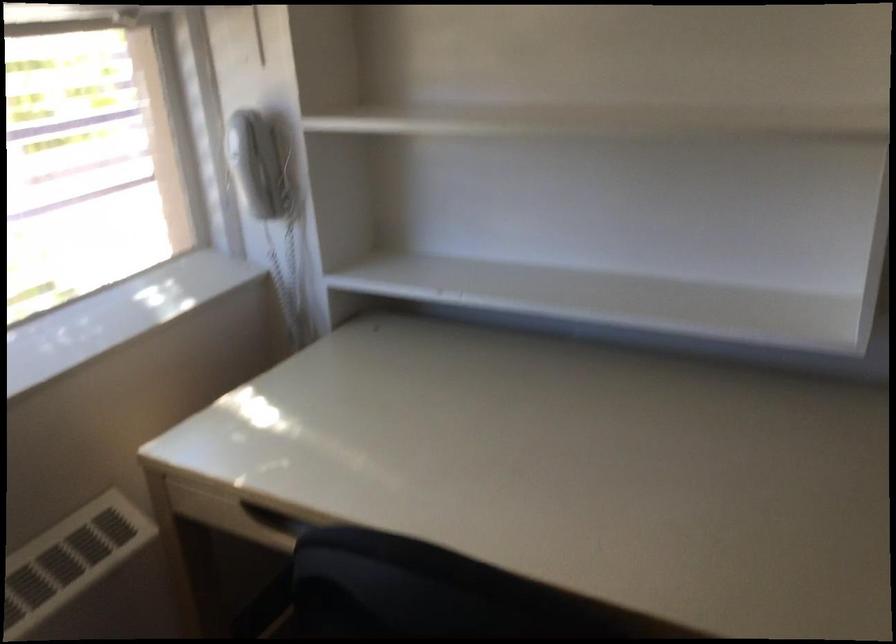
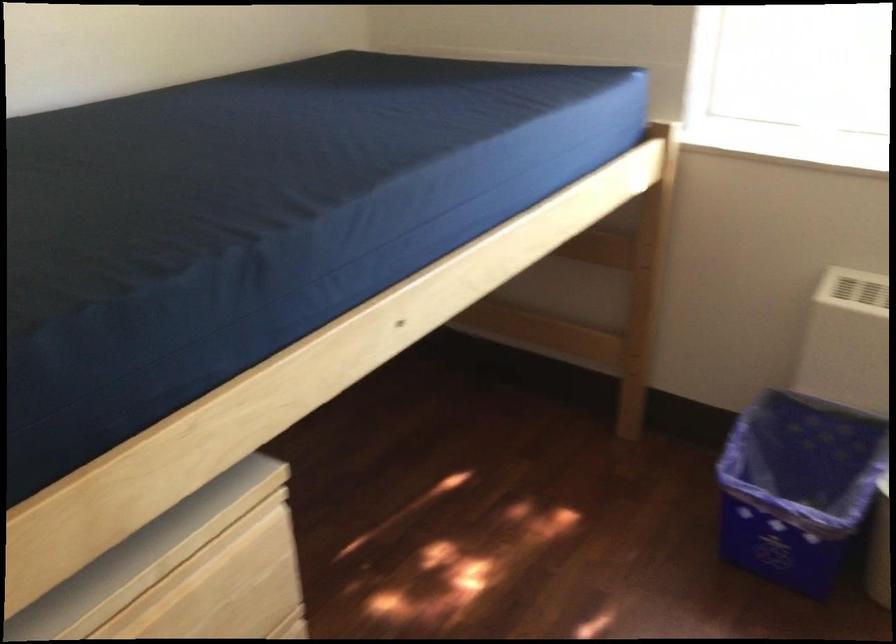
First-person continuous shooting, in which direction is the camera rotating?

The camera's rotation is toward left-down.